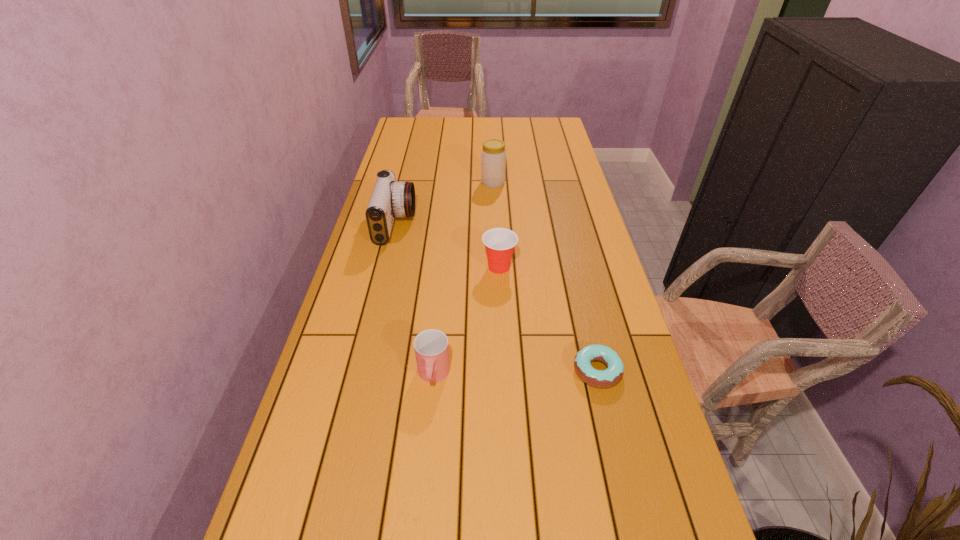
Locate an element on the screen. This screenshot has height=540, width=960. vacant area between the right cup and the left cup is located at coordinates (467, 321).

Select which object is the third closest to the farthest object. Please provide its 2D coordinates. Your answer should be formatted as a tuple, i.e. [(x, y)], where the tuple contains the x and y coordinates of a point satisfying the conditions above.

[(606, 378)]

Select which object appears as the third closest to the camcorder. Please provide its 2D coordinates. Your answer should be formatted as a tuple, i.e. [(x, y)], where the tuple contains the x and y coordinates of a point satisfying the conditions above.

[(431, 347)]

The image size is (960, 540). Identify the location of free location that satisfies the following two spatial constraints: 1. on the surface of the third nearest object; 2. on the right side of the camcorder. (385, 267).

Locate an element on the screen. The width and height of the screenshot is (960, 540). vacant region that satisfies the following two spatial constraints: 1. on the surface of the third farthest object; 2. on the right side of the leftmost object is located at coordinates (385, 267).